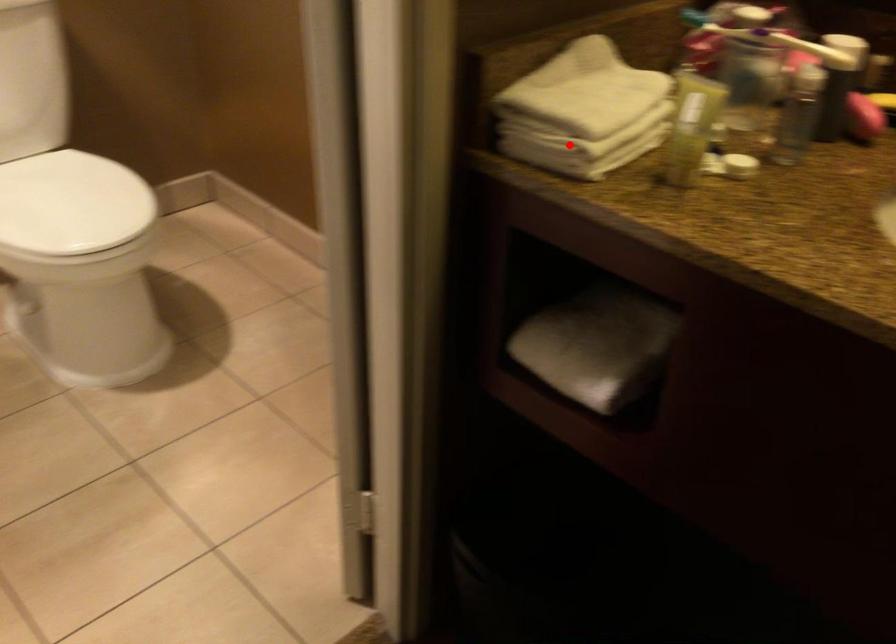
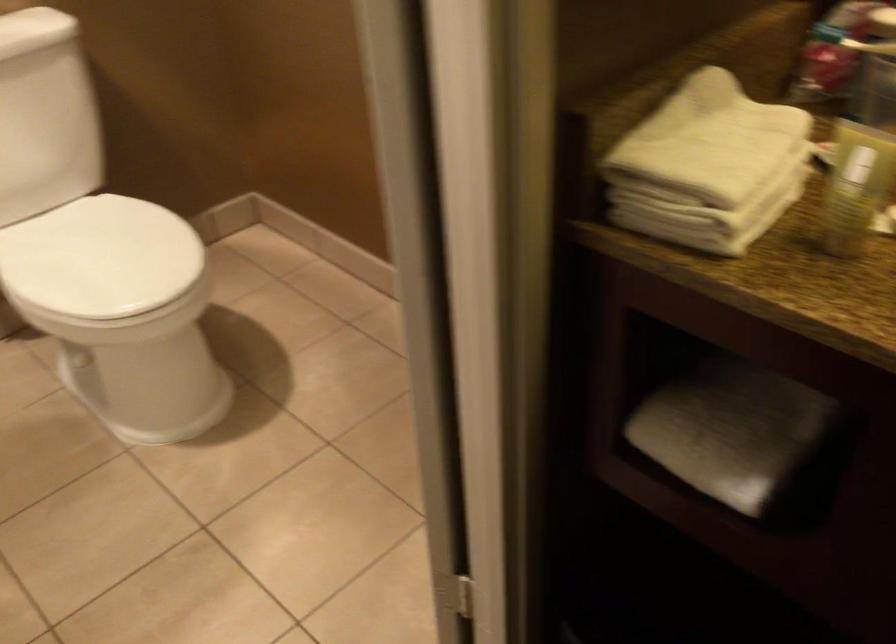
Locate, in the second image, the point that corresponds to the highlighted location in the first image.

(704, 219)